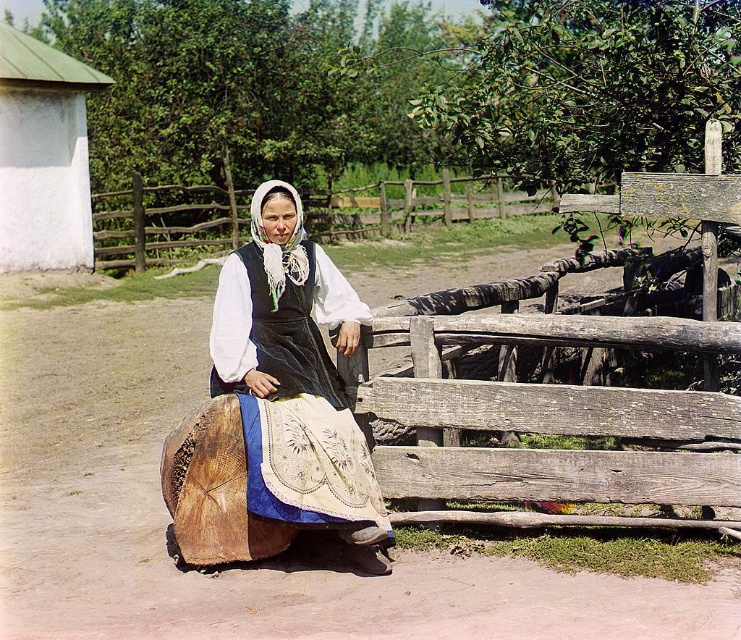
In the scene shown: You are standing in the countryside scene and want to place a small decoration between the two points, point (296, 456) and point (222, 209). To ensure the decoration is visible from where you are standing, which point should you place it closer to?

To ensure the decoration is visible from where you are standing, place it closer to point (296, 456) because it is closer to the viewer than point (222, 209).

In the scene shown: You are a photographer trying to capture the woman in the scene. If you focus on the white lace headscarf at center, will it block the view of the wooden at center behind it?

The white lace headscarf at center is in front of the wooden at center, so focusing on the headscarf would block the view of the wooden object behind it.

You are a photographer trying to capture the woman in the scene. You notice the white lace headscarf at center and the wooden at center. Which object is located to the right of the other?

The white lace headscarf at center is positioned on the right side of wooden at center.